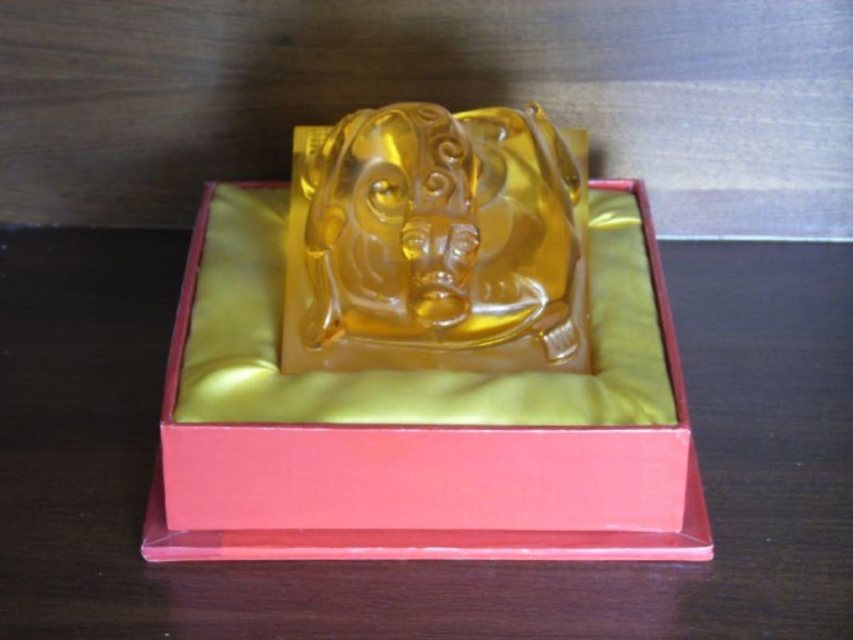
Which is in front, point (479, 444) or point (397, 205)?

Point (479, 444) is in front.

This screenshot has height=640, width=853. Identify the location of translucent amber statue at center. (424, 474).

I want to click on translucent amber statue at center, so click(424, 474).